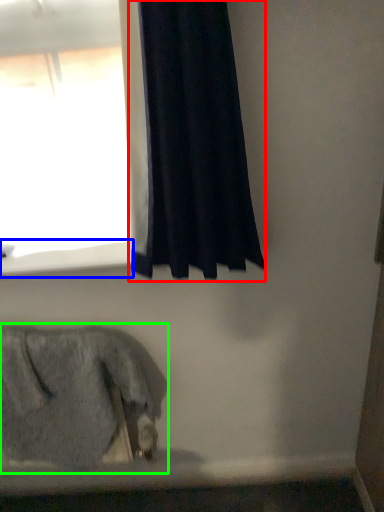
Question: Estimate the real-world distances between objects in this image. Which object is farther from curtain (highlighted by a red box), window sill (highlighted by a blue box) or animal (highlighted by a green box)?

Choices:
 (A) window sill
 (B) animal

Answer: (B)